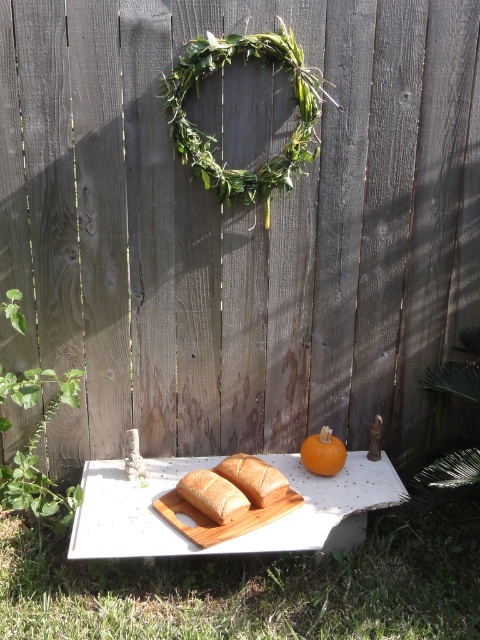
You are setting up a picnic and want to arrange the golden brown bread at center and orange matte pumpkin at center on the table. Which item should you place first to ensure stability?

The orange matte pumpkin at center should be placed first because it is taller than the golden brown bread at center, allowing the bread to rest stably on top or beside it without toppling over.

You are standing in front of the rustic outdoor setting and want to place a decorative vase on the white table. The table has a coordinate system where the bottom left corner is the origin. Where should you place the vase so it doesn not interfere with the golden brown bread at center?

The golden brown bread at center is located at point [253,477]. To avoid interference, place the vase away from this coordinate on the white table.

You are setting up a picnic and have a golden brown bread at center and an orange matte pumpkin at center on your table. Which item is closer to the ground?

The golden brown bread at center is closer to the ground because it is positioned below the orange matte pumpkin at center.